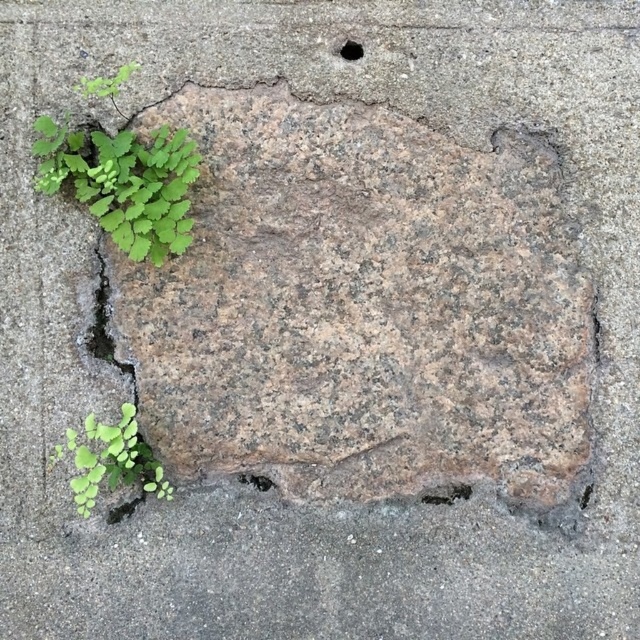
Between point (84, 461) and point (342, 54), which one is positioned in front?

Point (84, 461) is more forward.

Does green leafy plant at lower left come in front of black smooth hole at upper center?

Yes, green leafy plant at lower left is in front of black smooth hole at upper center.

What do you see at coordinates (109, 460) in the screenshot?
I see `green leafy plant at lower left` at bounding box center [109, 460].

Where is `green leafy plant at lower left`? green leafy plant at lower left is located at coordinates (109, 460).

Between rusty metal patch at lower left and black smooth hole at upper center, which one has more height?

black smooth hole at upper center

Is rusty metal patch at lower left positioned in front of black smooth hole at upper center?

That is False.

The width and height of the screenshot is (640, 640). I want to click on rusty metal patch at lower left, so click(256, 481).

Who is taller, brown rough stone at center or rusty metal patch at lower left?

With more height is brown rough stone at center.

Which of these two, brown rough stone at center or rusty metal patch at lower left, stands shorter?

Standing shorter between the two is rusty metal patch at lower left.

This screenshot has height=640, width=640. Describe the element at coordinates (360, 307) in the screenshot. I see `brown rough stone at center` at that location.

Image resolution: width=640 pixels, height=640 pixels. Identify the location of brown rough stone at center. (360, 307).